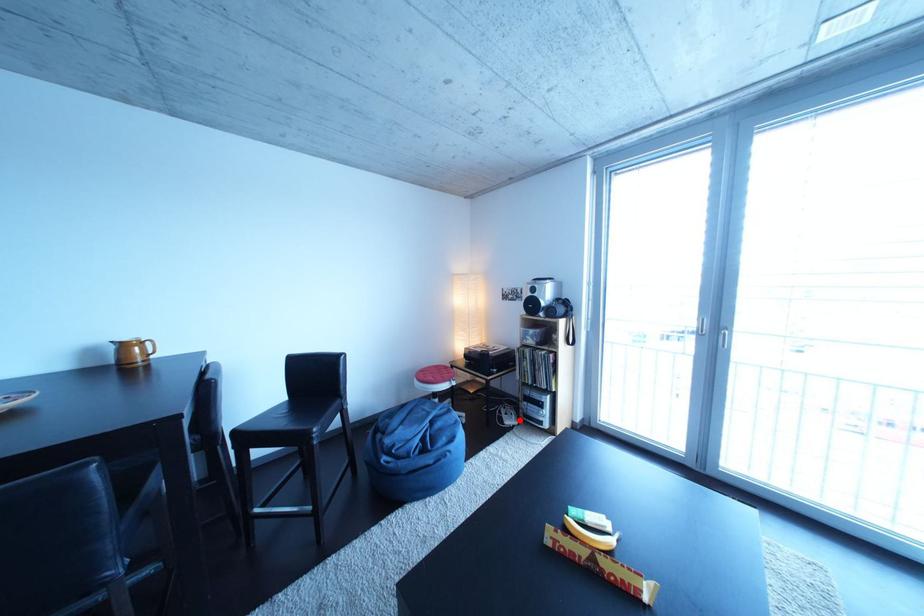
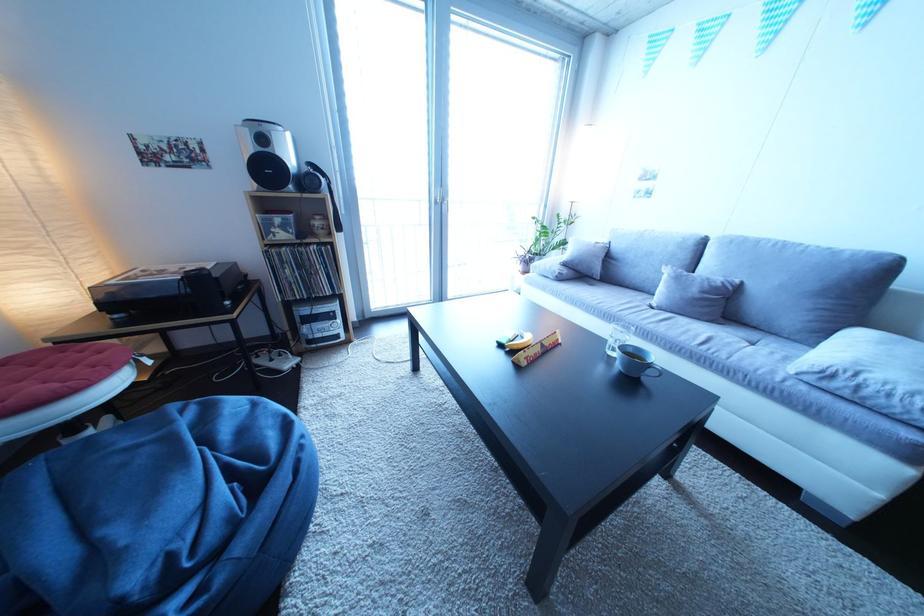
Question: I am providing you with two images of the same scene from different viewpoints. Given a red point in image1, look at the same physical point in image2. Is it:

Choices:
 (A) Closer to the viewpoint
 (B) Farther from the viewpoint

Answer: (A)